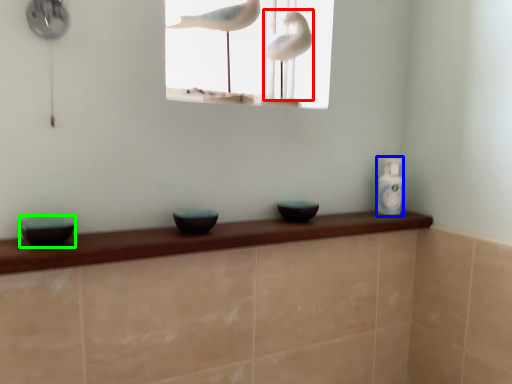
Question: Which object is the closest to the bird (highlighted by a red box)? Choose among these: bottle (highlighted by a blue box) or basin (highlighted by a green box).

Choices:
 (A) bottle
 (B) basin

Answer: (A)